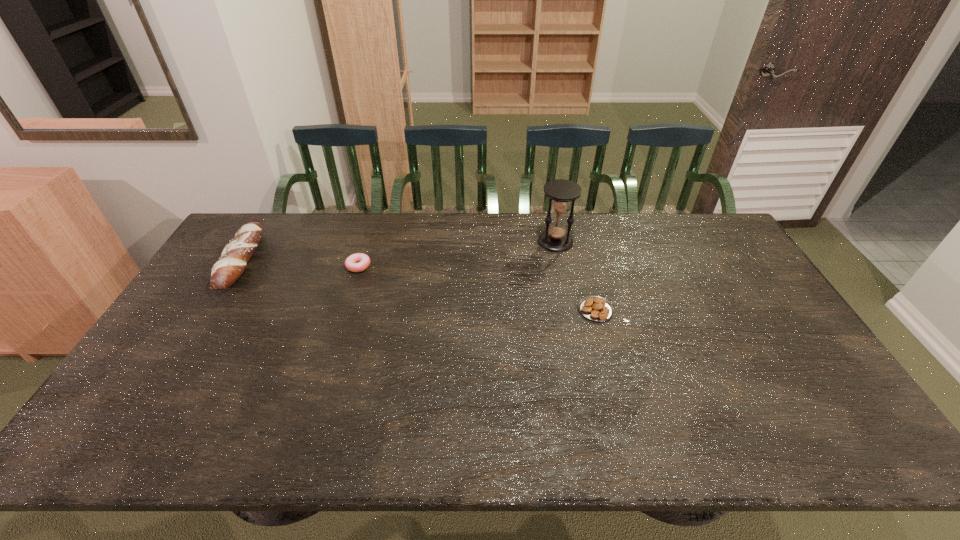
Image resolution: width=960 pixels, height=540 pixels. I want to click on vacant space in between the third object from right to left and the pastry, so click(x=477, y=288).

At what (x,y) coordinates should I click in order to perform the action: click on empty space between the doughnut and the tallest object. Please return your answer as a coordinate pair (x, y). The height and width of the screenshot is (540, 960). Looking at the image, I should click on (457, 254).

You are a GUI agent. You are given a task and a screenshot of the screen. Output one action in this format:
    pyautogui.click(x=<x>, y=<y>)
    Task: Click on the free space between the doughnut and the leftmost object
    The image size is (960, 540).
    Given the screenshot: What is the action you would take?
    pyautogui.click(x=300, y=264)

Where is `free space between the baguet and the pastry`? The width and height of the screenshot is (960, 540). free space between the baguet and the pastry is located at coordinates (419, 286).

Image resolution: width=960 pixels, height=540 pixels. I want to click on unoccupied area between the doughnut and the pastry, so click(477, 288).

I want to click on unoccupied area between the doughnut and the leftmost object, so pos(300,264).

Locate an element on the screen. This screenshot has width=960, height=540. unoccupied position between the baguet and the doughnut is located at coordinates (300, 264).

Where is `unoccupied position between the second tallest object and the tallest object`? This screenshot has width=960, height=540. unoccupied position between the second tallest object and the tallest object is located at coordinates (398, 252).

Find the location of a particular element. Image resolution: width=960 pixels, height=540 pixels. free point between the baguet and the hourglass is located at coordinates (398, 252).

What are the coordinates of `free spot between the leftmost object and the pastry` in the screenshot? It's located at (419, 286).